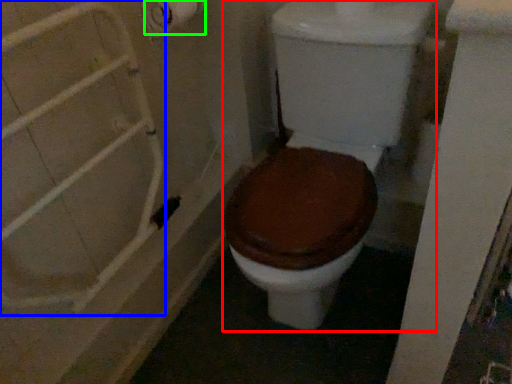
Question: Estimate the real-world distances between objects in this image. Which object is closer to toilet (highlighted by a red box), shower door (highlighted by a blue box) or toilet paper (highlighted by a green box)?

Choices:
 (A) shower door
 (B) toilet paper

Answer: (A)